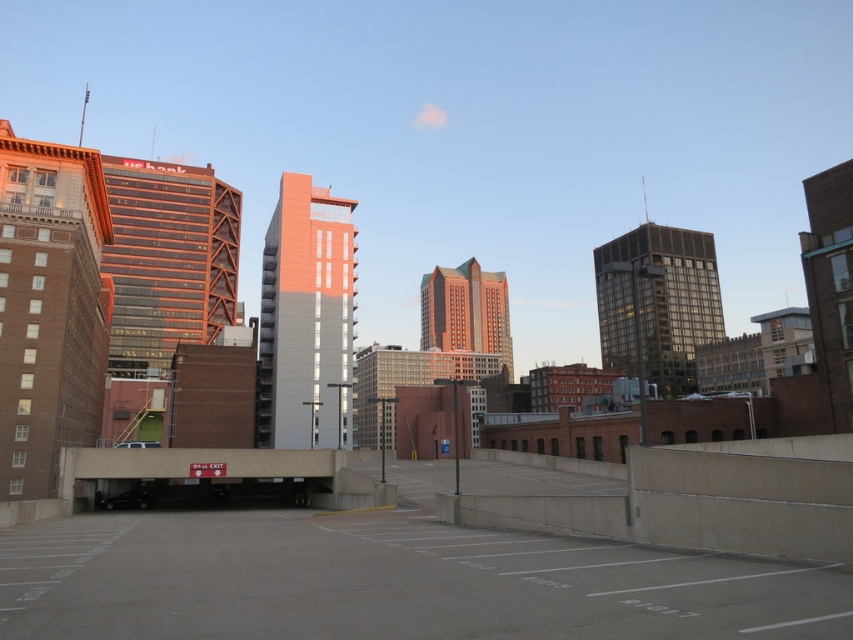
What is the 2D coordinate of the gray concrete parking lot at center?

The gray concrete parking lot at center is located at the 2D coordinate point of (387, 582).

From the picture: You are a delivery driver who needs to park your truck in the gray concrete parking lot at center. However, the shiny black sedan at lower left is blocking the entrance. Can you drive around the sedan to access the parking lot?

The gray concrete parking lot at center is located above the shiny black sedan at lower left, so you can drive around the sedan to access the parking lot since the parking lot is elevated and not directly blocked by the sedan.

You are a delivery driver who needs to park your shiny black sedan at lower left into the gray concrete parking lot at center. The parking lot has a height restriction of 4 meters. Can you safely enter the parking lot with your vehicle?

The gray concrete parking lot at center is 41.78 meters away from the shiny black sedan at lower left. However, the distance between them does not indicate the vehicle height. Since the question is about height restriction, the provided information is insufficient to determine if the shiny black sedan at lower left can safely enter the parking lot.